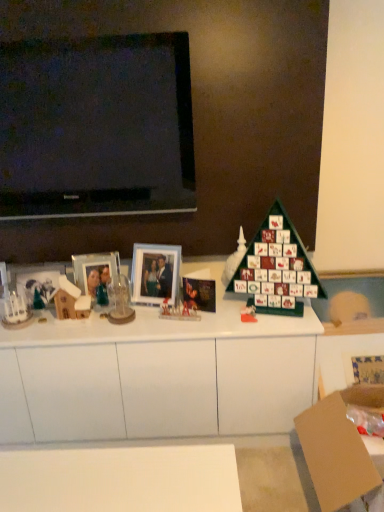
The height and width of the screenshot is (512, 384). What are the coordinates of `vacant space that is in between glossy paper christmas card at center and white matte christmas tree at center, acting as the third toy starting from the left` in the screenshot? It's located at (225, 302).